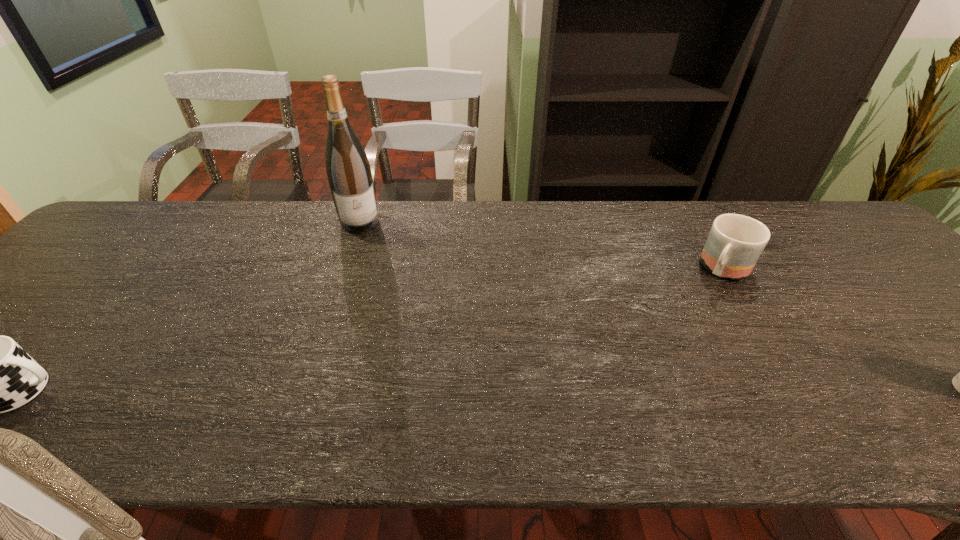
The image size is (960, 540). I want to click on object that is at the far edge, so click(349, 174).

Locate an element on the screen. vacant space at the far edge is located at coordinates (484, 219).

Identify the location of free space at the near edge of the desktop. The image size is (960, 540). (615, 388).

In the image, there is a desktop. Where is `vacant space at the far right corner`? The image size is (960, 540). vacant space at the far right corner is located at coordinates (837, 229).

Locate an element on the screen. The height and width of the screenshot is (540, 960). unoccupied position between the farthest object and the rightmost object is located at coordinates (541, 245).

In order to click on empty location between the wine bottle and the second nearest object in this screenshot , I will do `click(541, 245)`.

The image size is (960, 540). I want to click on free space between the second object from right to left and the mug, so click(541, 245).

Select which object is the second closest to the tallest object. Please provide its 2D coordinates. Your answer should be formatted as a tuple, i.e. [(x, y)], where the tuple contains the x and y coordinates of a point satisfying the conditions above.

[(735, 242)]

Image resolution: width=960 pixels, height=540 pixels. In order to click on the second closest object relative to the second nearest object in this screenshot , I will do `click(0, 376)`.